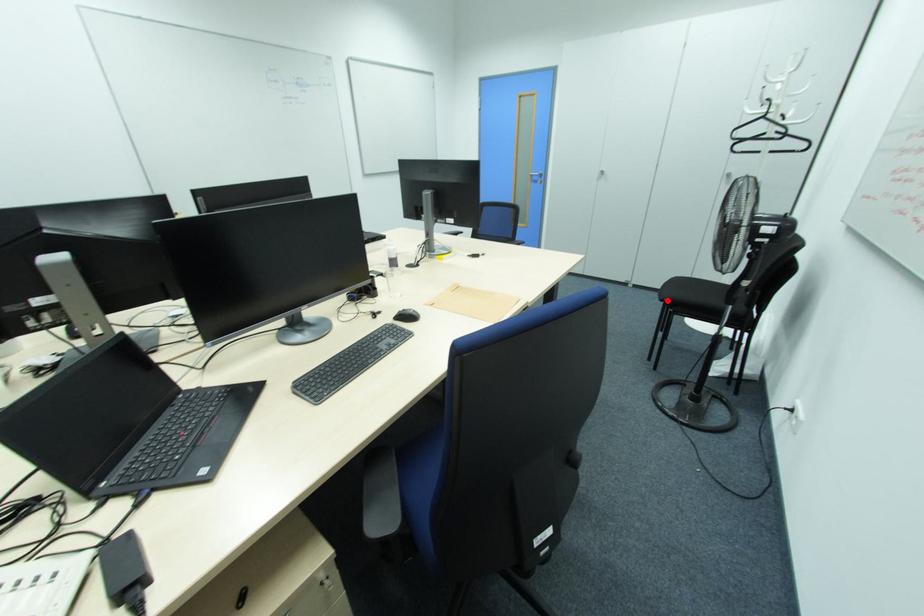
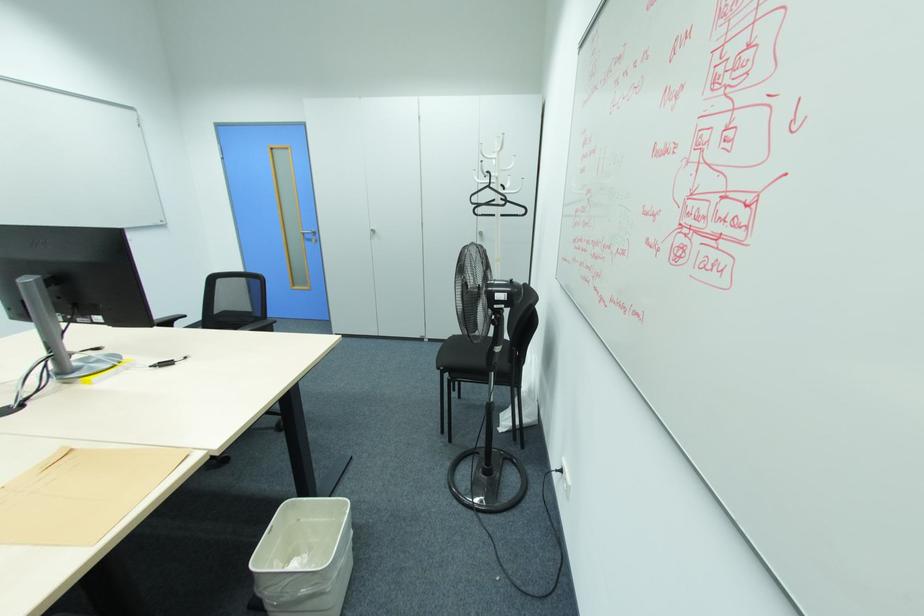
Question: I am providing you with two images of the same scene from different viewpoints. Image1 has a red point marked. In image2, the corresponding 3D location appears at what relative position? Reply with the corresponding letter.

Choices:
 (A) Closer
 (B) Farther

Answer: (B)